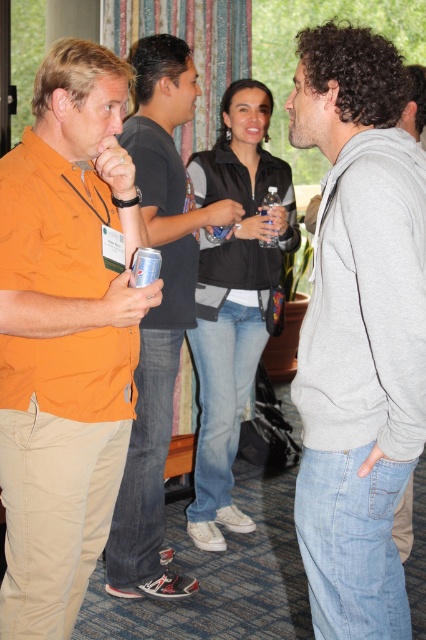
You are standing in the conference room and want to take a photo of both point [402,336] and point [135,566]. Which point should you focus on first to ensure both are in focus?

You should focus on point [402,336] first because it is closer to the camera than point [135,566], ensuring both are within the depth of field.

You are organizing a clothing donation drive and need to categorize the orange cotton shirt at left and the gray cotton hoodie at center based on their sizes. Which clothing item has a larger width?

The orange cotton shirt at left has a larger width than the gray cotton hoodie at center according to the description.